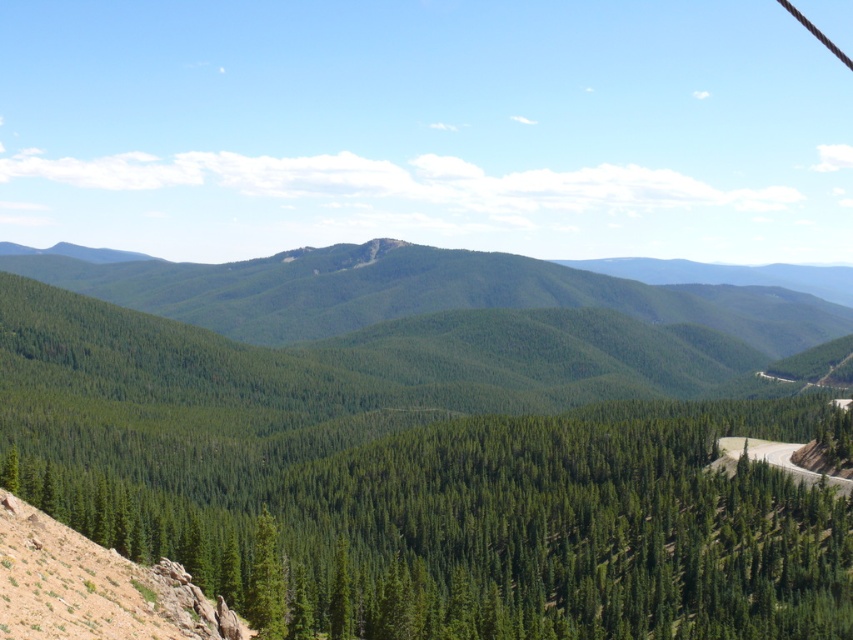
Based on the photo, who is more distant from viewer, (x=392, y=497) or (x=815, y=480)?

The point (x=392, y=497) is more distant.

This screenshot has height=640, width=853. What do you see at coordinates (503, 529) in the screenshot? I see `green textured trees at center` at bounding box center [503, 529].

Between point (218, 532) and point (715, 467), which one is positioned in front?

Point (218, 532) is more forward.

Locate an element on the screen. This screenshot has width=853, height=640. green textured trees at center is located at coordinates (503, 529).